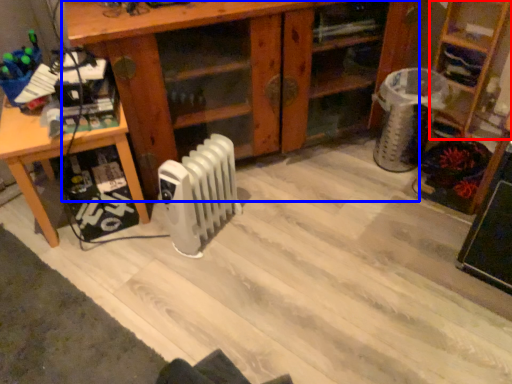
Question: Which of the following is the closest to the observer, shelf (highlighted by a red box) or shelf (highlighted by a blue box)?

Choices:
 (A) shelf
 (B) shelf

Answer: (B)